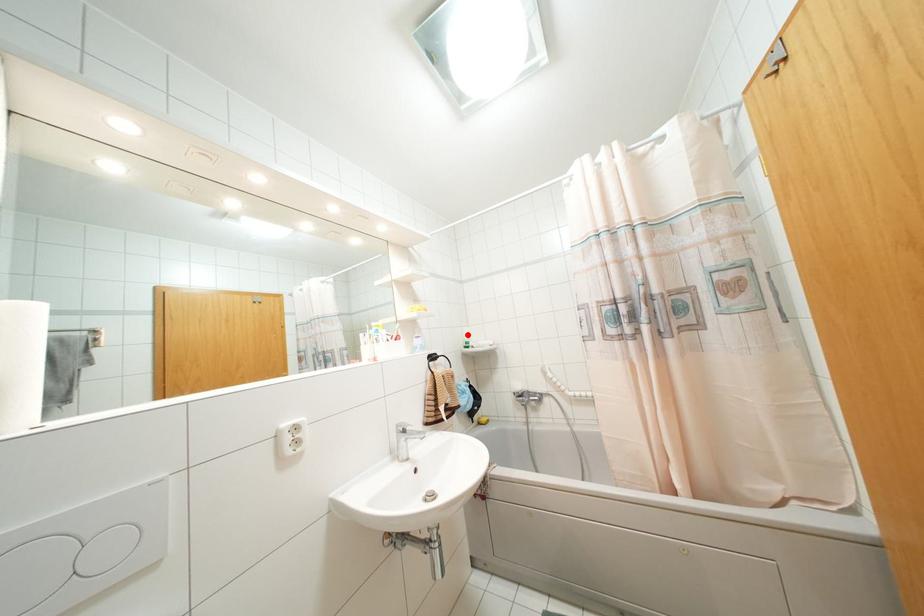
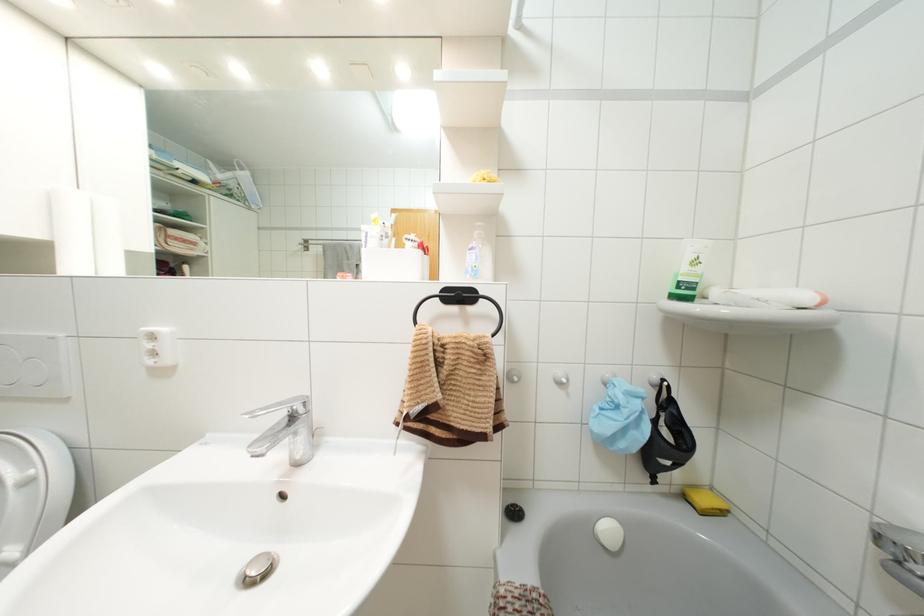
Find the pixel in the second image that matches the highlighted location in the first image.

(695, 262)